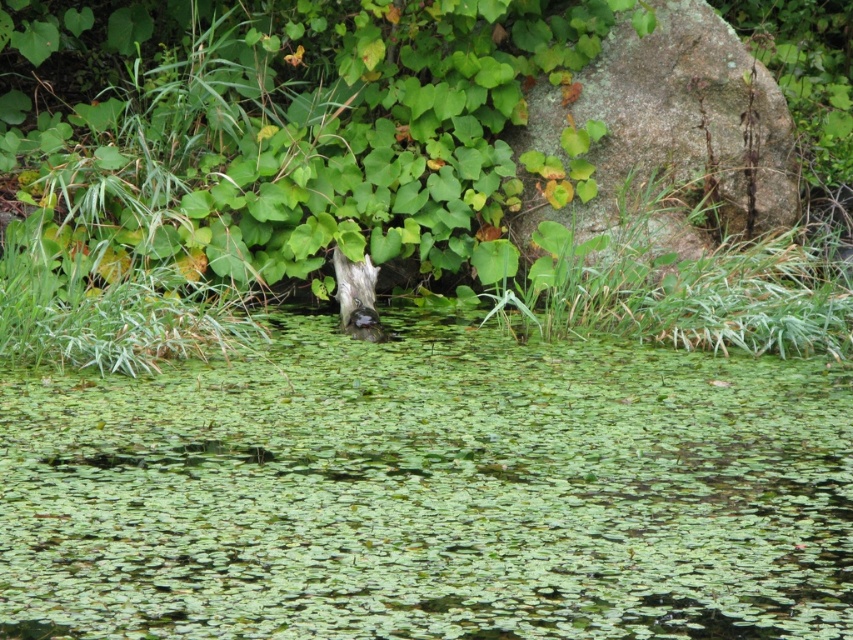
Question: Which point is farther to the camera?

Choices:
 (A) (381, 433)
 (B) (683, 244)

Answer: (B)

Question: Is green leafy water at center to the left of gray mossy rock at upper right from the viewer's perspective?

Choices:
 (A) no
 (B) yes

Answer: (B)

Question: Can you confirm if green leafy water at center is positioned below gray mossy rock at upper right?

Choices:
 (A) yes
 (B) no

Answer: (A)

Question: Is green leafy water at center further to the viewer compared to gray mossy rock at upper right?

Choices:
 (A) no
 (B) yes

Answer: (A)

Question: Which point is farther to the camera?

Choices:
 (A) green leafy water at center
 (B) gray mossy rock at upper right

Answer: (B)

Question: Which point is closer to the camera?

Choices:
 (A) (434, 492)
 (B) (525, 157)

Answer: (A)